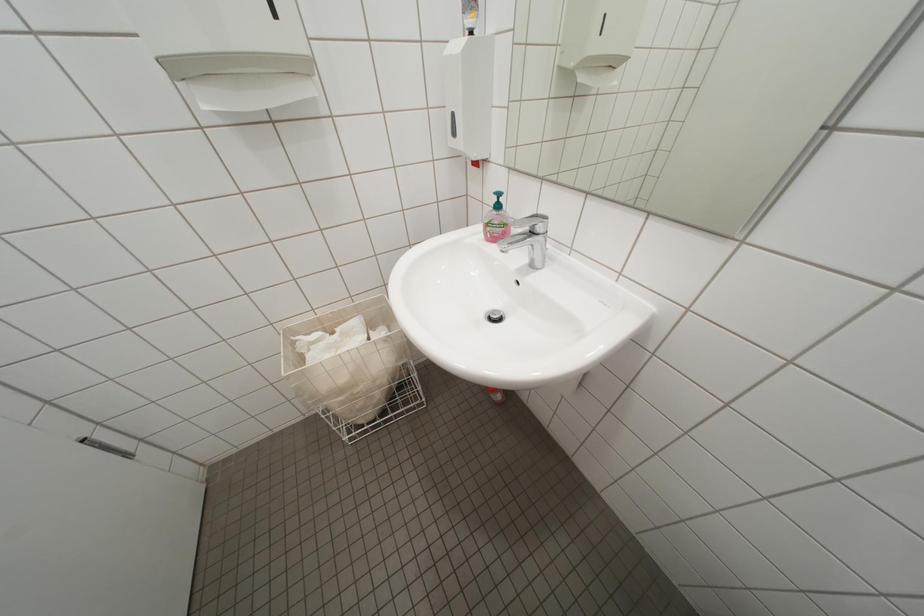
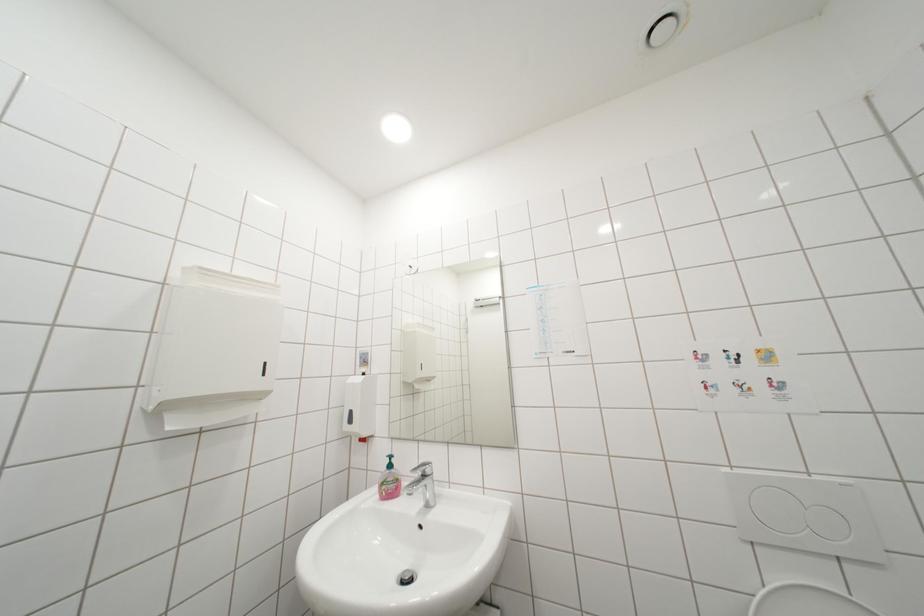
The first image is from the beginning of the video and the second image is from the end. How did the camera likely rotate when shooting the video?

The rotation direction of the camera is right-up.